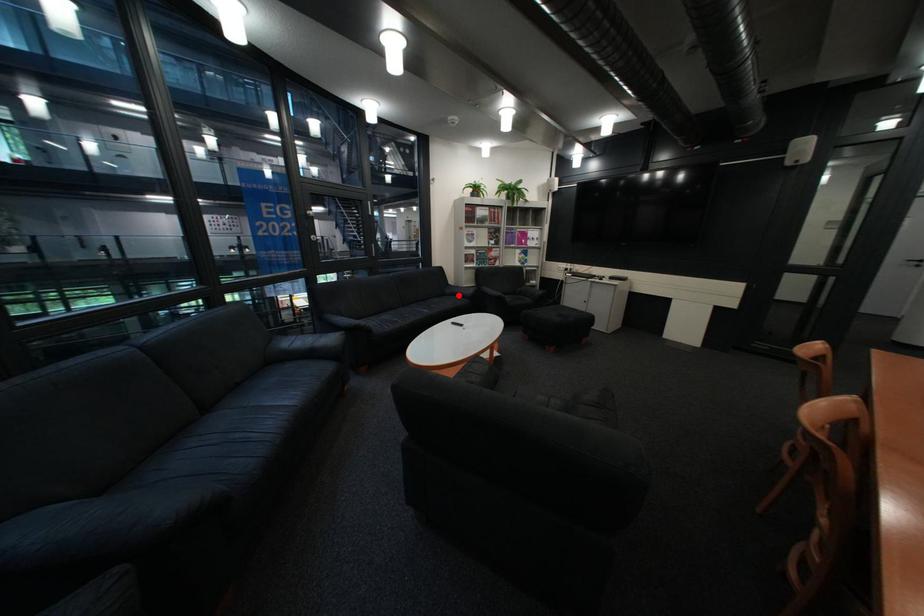
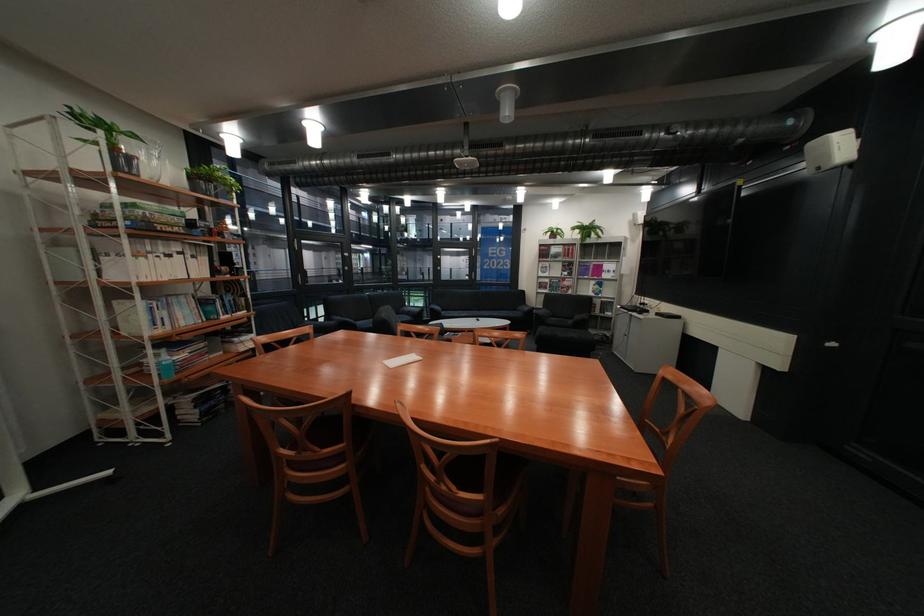
In the second image, find the point that corresponds to the highlighted location in the first image.

(531, 310)